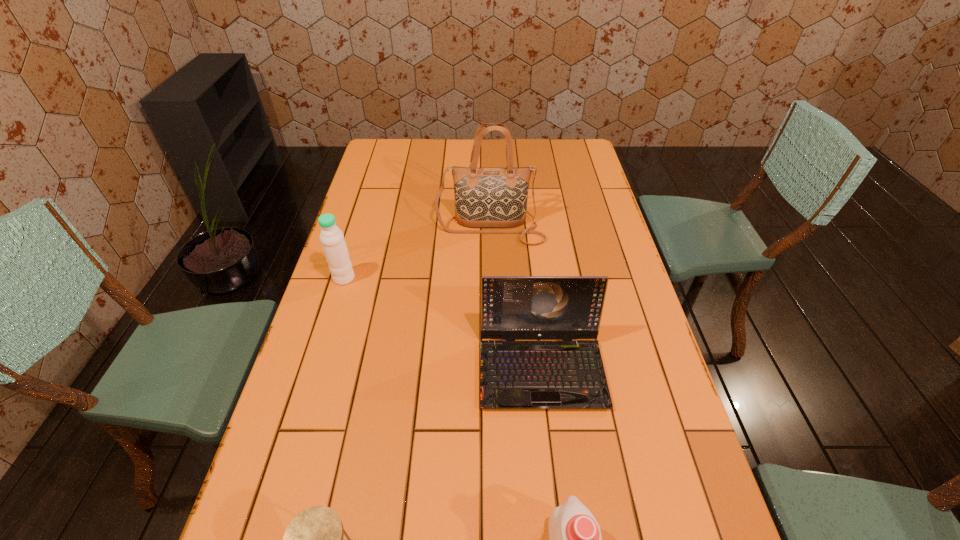
I want to click on vacant region at the far edge of the desktop, so click(x=454, y=146).

In the image, there is a desktop. Where is `vacant space at the left edge`? This screenshot has height=540, width=960. vacant space at the left edge is located at coordinates (322, 387).

In the image, there is a desktop. Where is `vacant space at the right edge`? The image size is (960, 540). vacant space at the right edge is located at coordinates (601, 197).

Where is `free space that is in between the leftmost object and the third nearest object`? free space that is in between the leftmost object and the third nearest object is located at coordinates pyautogui.click(x=443, y=323).

The image size is (960, 540). I want to click on vacant point located between the laptop computer and the water bottle, so click(x=443, y=323).

Choose which object is the nearest neighbor to the shortest object. Please provide its 2D coordinates. Your answer should be formatted as a tuple, i.e. [(x, y)], where the tuple contains the x and y coordinates of a point satisfying the conditions above.

[(566, 374)]

Where is `object that ranks as the fourth closest to the handbag`? The image size is (960, 540). object that ranks as the fourth closest to the handbag is located at coordinates (314, 539).